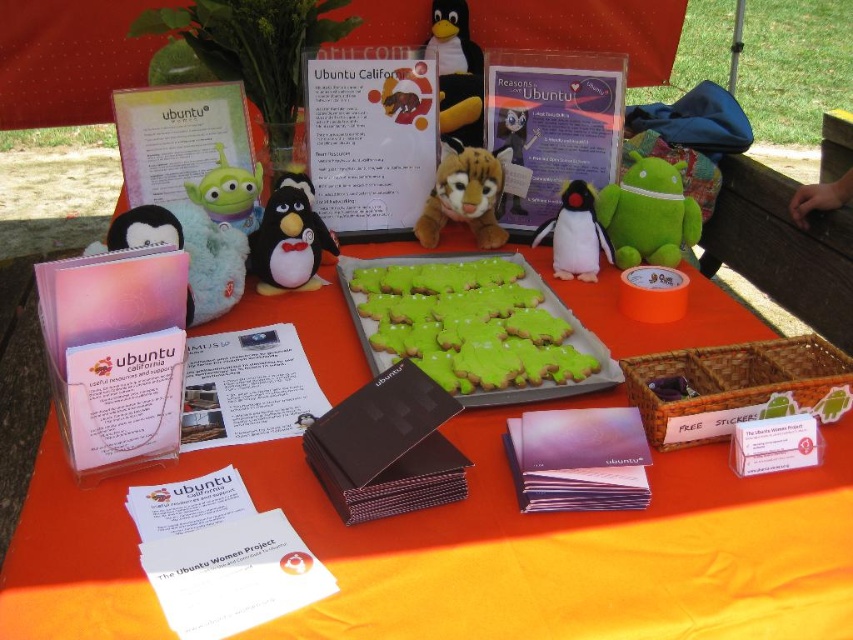
Does matte black plush penguin at center have a lesser height compared to plush tiger at center?

Yes, matte black plush penguin at center is shorter than plush tiger at center.

Which is more to the right, matte black plush penguin at center or plush tiger at center?

plush tiger at center

The width and height of the screenshot is (853, 640). Describe the element at coordinates (289, 237) in the screenshot. I see `matte black plush penguin at center` at that location.

Identify the location of matte black plush penguin at center. This screenshot has width=853, height=640. (289, 237).

Who is positioned more to the left, matte black plush penguin at center or black plush penguin at upper center?

Positioned to the left is matte black plush penguin at center.

Does point (270, 241) lie in front of point (457, 90)?

That is True.

This screenshot has height=640, width=853. What do you see at coordinates (289, 237) in the screenshot? I see `matte black plush penguin at center` at bounding box center [289, 237].

What are the coordinates of `matte black plush penguin at center` in the screenshot? It's located at (289, 237).

Does matte black plush penguin at center appear on the left side of plush green alien at center?

In fact, matte black plush penguin at center is to the right of plush green alien at center.

Who is more distant from viewer, (303,184) or (257,173)?

Point (257,173)

Find the location of `matte black plush penguin at center`. matte black plush penguin at center is located at coordinates (289, 237).